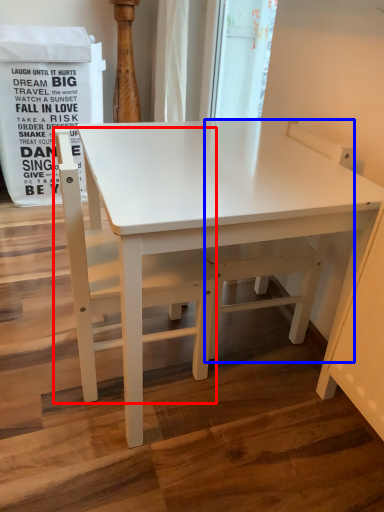
Question: Which object is further to the camera taking this photo, chair (highlighted by a red box) or swivel chair (highlighted by a blue box)?

Choices:
 (A) chair
 (B) swivel chair

Answer: (B)